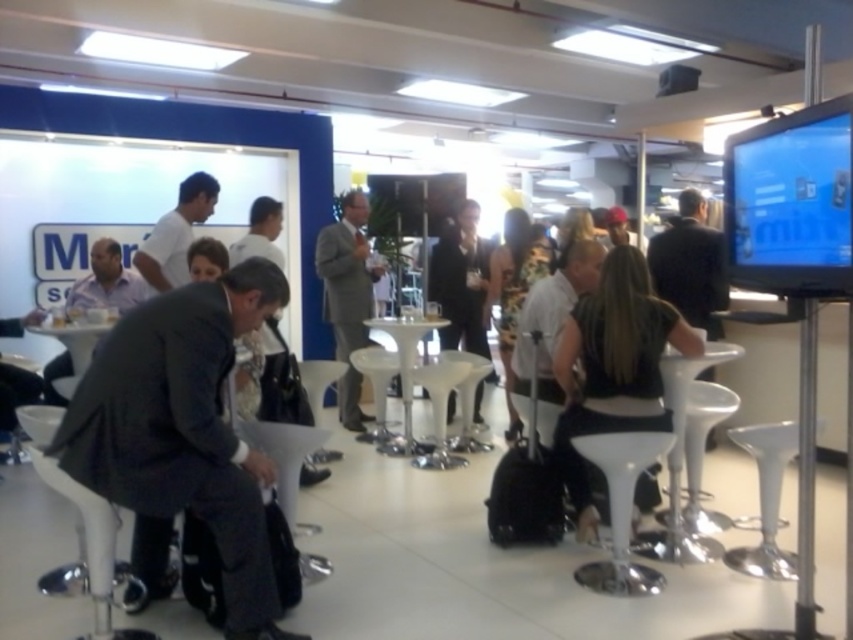
You are organizing a charity event and need to decide which clothing item to donate. Based on the image, which item is larger in size between the black fabric dress at center and the white shirt at upper center?

The black fabric dress at center is bigger than the white shirt at upper center, so you should donate the black fabric dress at center as it is larger.

You are standing in the conference room and notice a black fabric dress at center. Can you determine its exact location using the coordinate system provided in the scene description?

The black fabric dress at center is located at point (613, 368) according to the coordinate system provided.